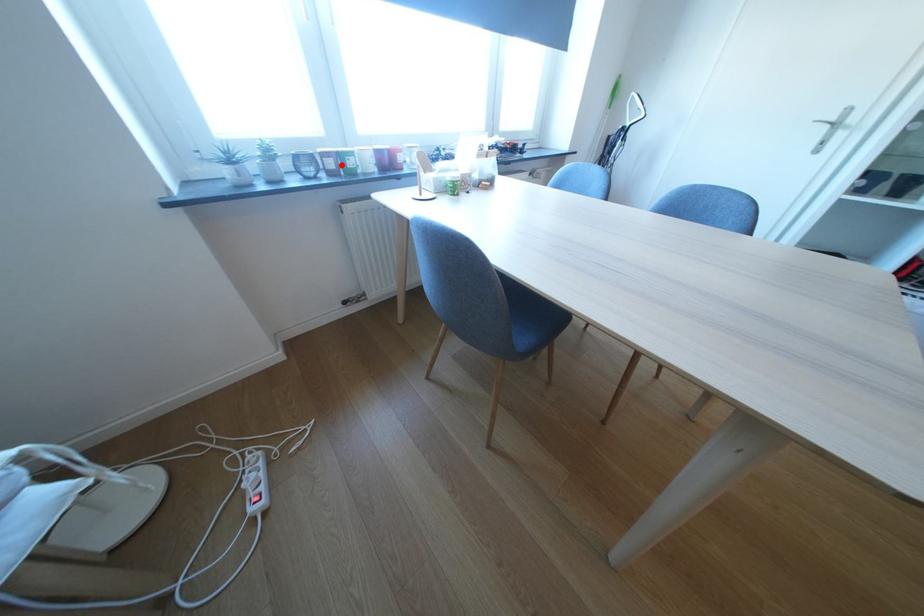
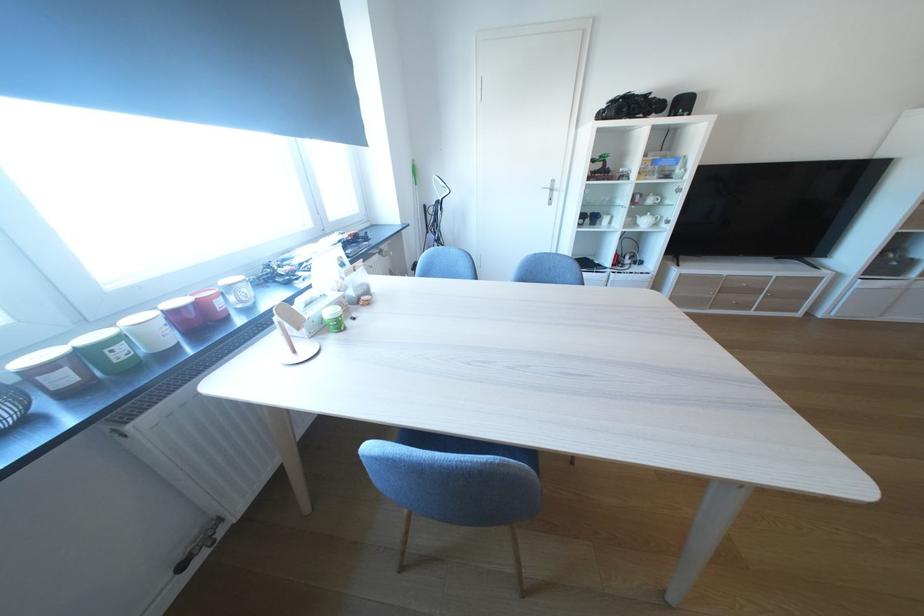
Question: I am providing you with two images of the same scene from different viewpoints. A red point is marked on the first image. Can you still see the location of the red point in image 2?

Choices:
 (A) Yes
 (B) No

Answer: (A)